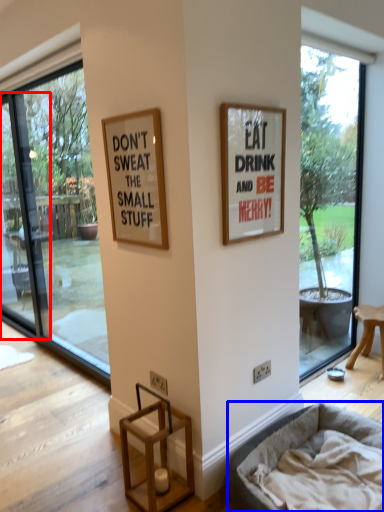
Question: Among these objects, which one is nearest to the camera, screen door (highlighted by a red box) or dog bed (highlighted by a blue box)?

Choices:
 (A) screen door
 (B) dog bed

Answer: (B)